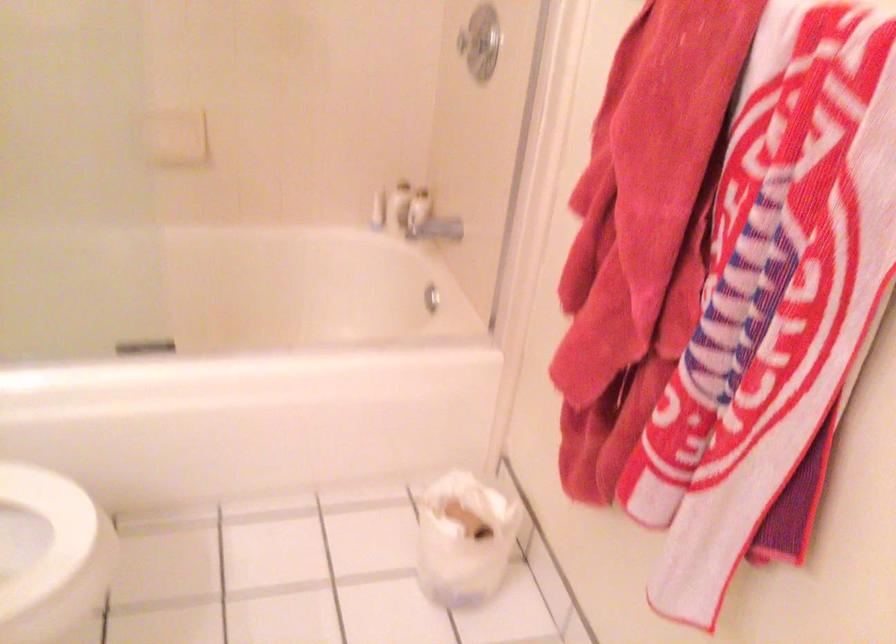
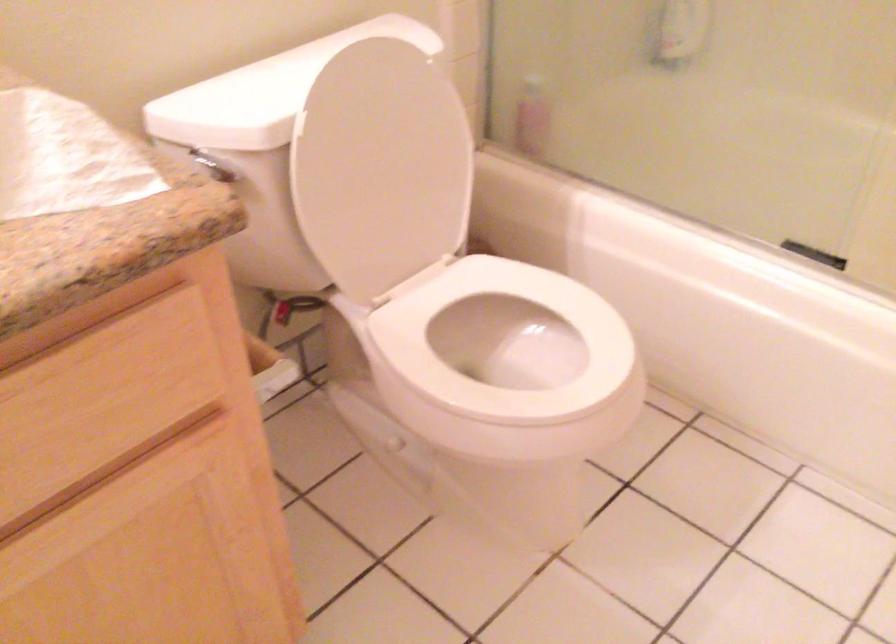
The images are taken continuously from a first-person perspective. In which direction is your viewpoint rotating?

The camera rotated toward left-down.